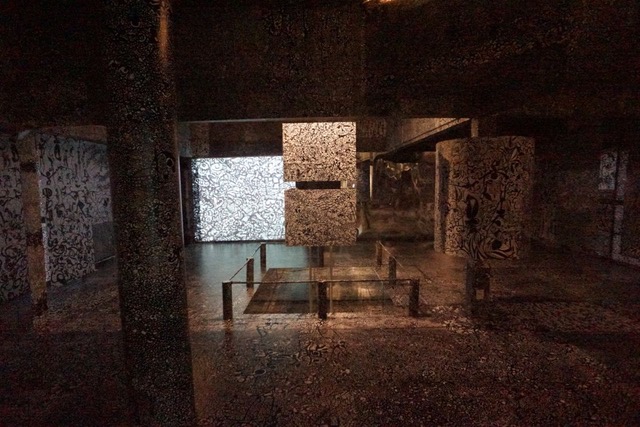
At what (x,y) coordinates should I click in order to perform the action: click on hallway. Please return your answer as a coordinate pair (x, y). Looking at the image, I should click on (419, 191).